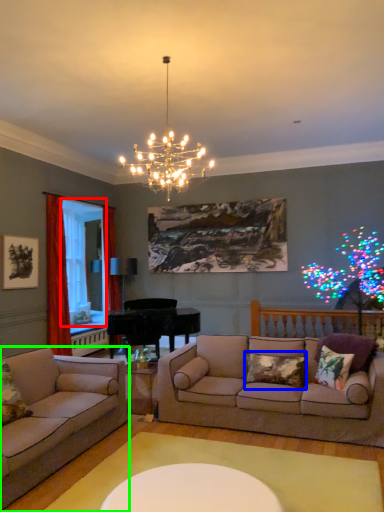
Question: Which object is the closest to the window screen (highlighted by a red box)? Choose among these: pillow (highlighted by a blue box) or studio couch (highlighted by a green box).

Choices:
 (A) pillow
 (B) studio couch

Answer: (B)